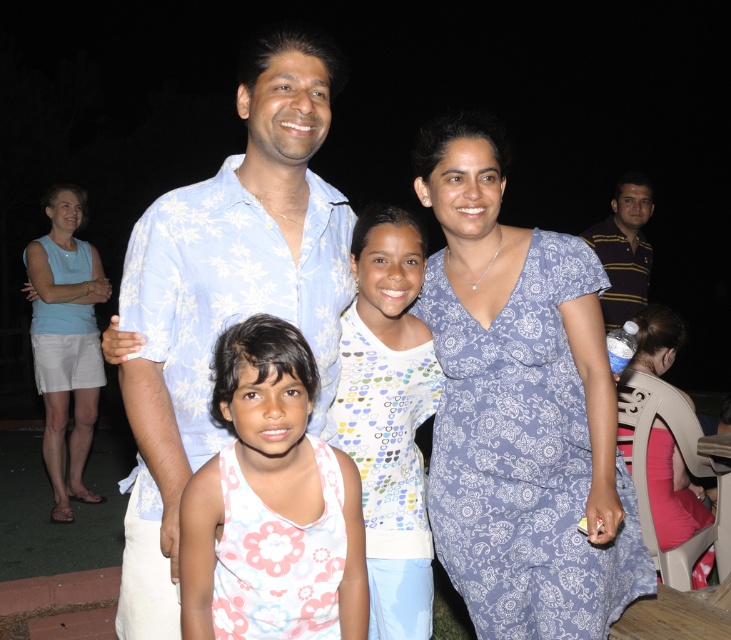
You are a photographer trying to focus on the family members in this image. Which piece of clothing is nearer to you, the floral tank top at center or the striped polo shirt at right?

The floral tank top at center is closer to the viewer than the striped polo shirt at right.

You are standing at the point with coordinates point (x=279, y=582) and want to walk towards point (x=621, y=314). Given that you can only move forward in a straight line, will you reach the second point without any obstacles?

Yes, since point (x=279, y=582) is in front of point (x=621, y=314), you can walk straight towards it without any obstacles.

You are a photographer at a nighttime event. You need to adjust the camera focus to ensure both the blue paisley dress at center and the light blue floral shirt at center are visible. Which clothing item should you focus on first to account for their height difference?

The blue paisley dress at center has a lesser height compared to the light blue floral shirt at center, so you should focus on the light blue floral shirt at center first as it is taller and might require more precise focusing to capture details.